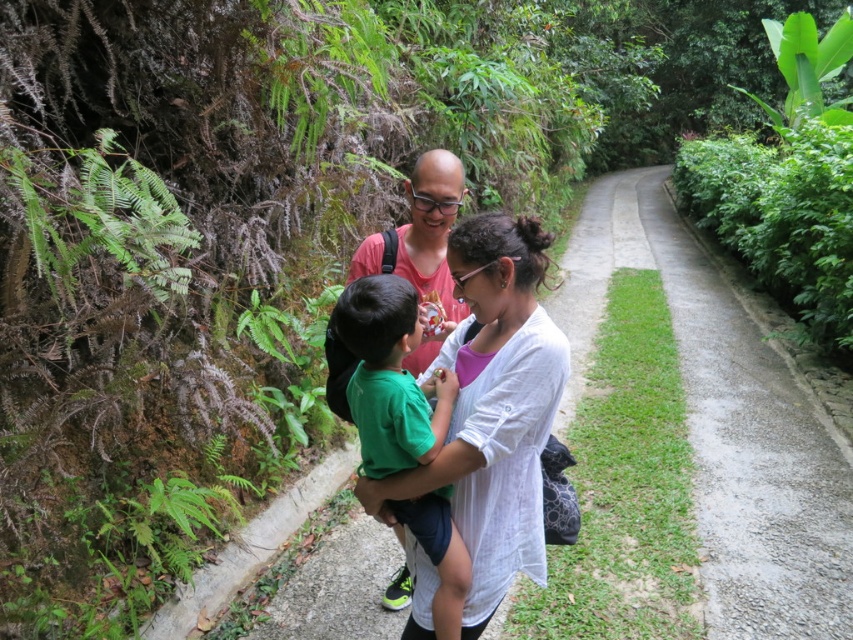
You are standing at the point with coordinates point [399,408] and want to walk towards the point with coordinates point [532,333]. Since you can only move forward, will you be moving closer to or further away from the camera?

Since point [532,333] is further to the camera than point [399,408], moving towards it means you are moving closer to the camera.

You are a hiker trying to navigate the narrow path between the dense vegetation and the grassy area. You notice the white cotton shirt at center and the green leafy fern at left. Which object is closer to the ground?

The white cotton shirt at center is below the green leafy fern at left, so it is closer to the ground.